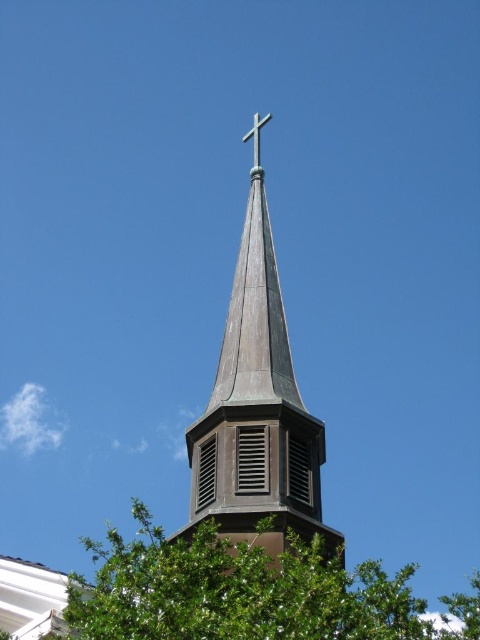
Question: Does green leafy tree at center appear on the left side of metallic cross at upper center?

Choices:
 (A) no
 (B) yes

Answer: (A)

Question: Which object appears closest to the camera in this image?

Choices:
 (A) green leafy tree at center
 (B) shiny copper steeple at center

Answer: (A)

Question: Is green leafy tree at center smaller than shiny copper steeple at center?

Choices:
 (A) yes
 (B) no

Answer: (B)

Question: Which object is positioned farthest from the green leafy tree at center?

Choices:
 (A) metallic cross at upper center
 (B) shiny copper steeple at center

Answer: (A)

Question: Estimate the real-world distances between objects in this image. Which object is closer to the shiny copper steeple at center?

Choices:
 (A) green leafy tree at center
 (B) metallic cross at upper center

Answer: (A)

Question: Can you confirm if green leafy tree at center is smaller than shiny copper steeple at center?

Choices:
 (A) no
 (B) yes

Answer: (A)